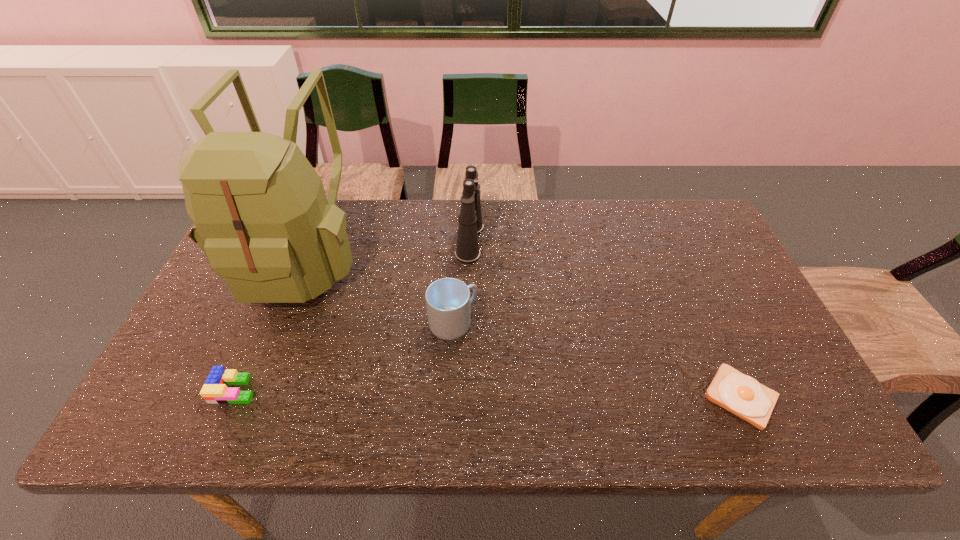
Where is `vacant position located on the back of the rightmost object`? The image size is (960, 540). vacant position located on the back of the rightmost object is located at coordinates (687, 279).

I want to click on backpack at the far edge, so click(261, 216).

This screenshot has height=540, width=960. I want to click on binoculars that is at the far edge, so click(467, 251).

The image size is (960, 540). I want to click on Lego that is positioned at the near edge, so click(214, 390).

Locate an element on the screen. The width and height of the screenshot is (960, 540). toast located at the near edge is located at coordinates (740, 394).

Where is `backpack at the left edge`? backpack at the left edge is located at coordinates (261, 216).

The image size is (960, 540). I want to click on Lego at the left edge, so click(x=214, y=390).

This screenshot has width=960, height=540. Find the location of `object at the right edge`. object at the right edge is located at coordinates (740, 394).

You are a GUI agent. You are given a task and a screenshot of the screen. Output one action in this format:
    pyautogui.click(x=<x>, y=<y>)
    Task: Click on the object that is positioned at the far left corner
    This screenshot has width=960, height=540.
    Given the screenshot: What is the action you would take?
    pyautogui.click(x=261, y=216)

Where is `object present at the near left corner`? This screenshot has width=960, height=540. object present at the near left corner is located at coordinates (214, 390).